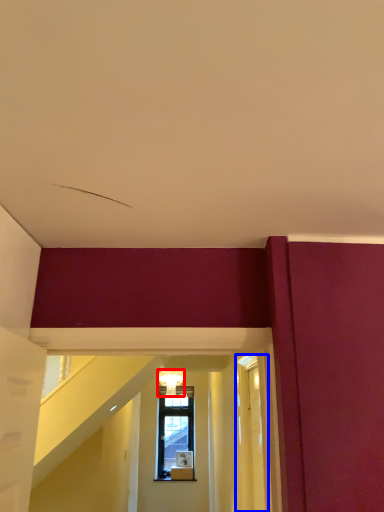
Question: Which object is further to the camera taking this photo, light fixture (highlighted by a red box) or glass door (highlighted by a blue box)?

Choices:
 (A) light fixture
 (B) glass door

Answer: (A)